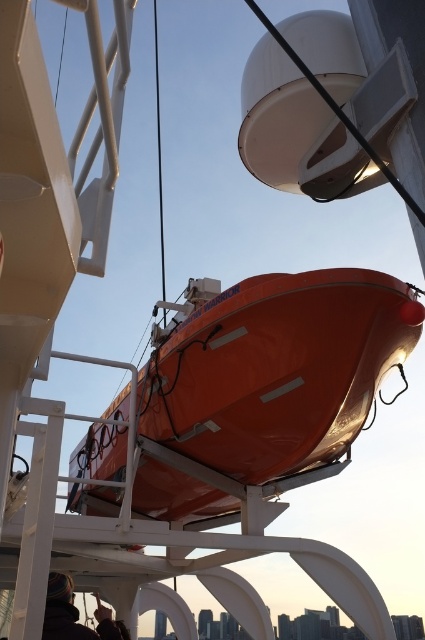
Between orange glossy boat at center and dark brown leather jacket at lower left, which one is positioned higher?

orange glossy boat at center is higher up.

Which is behind, point (209, 307) or point (67, 589)?

Point (209, 307)

Is point (186, 294) closer to viewer compared to point (70, 596)?

No, (186, 294) is further to viewer.

Identify the location of orange glossy boat at center. The image size is (425, 640). (265, 387).